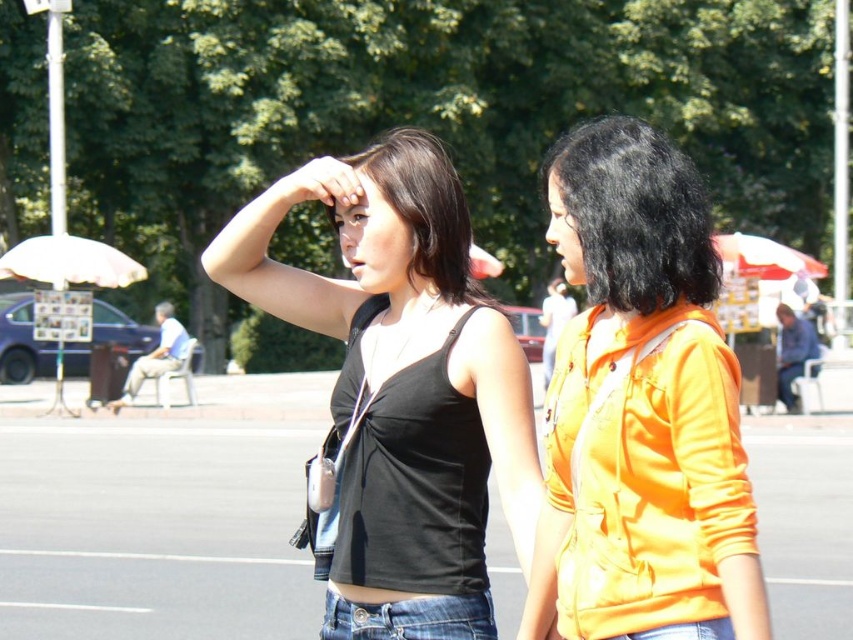
Question: Estimate the real-world distances between objects in this image. Which object is closer to the jeans at center?

Choices:
 (A) black silky hair at upper right
 (B) black matte tank top at center
 (C) orange matte jacket at right
 (D) black smooth hair at center

Answer: (C)

Question: Is black silky hair at upper right above jeans at center?

Choices:
 (A) no
 (B) yes

Answer: (B)

Question: In this image, where is orange matte jacket at right located relative to black silky hair at upper right?

Choices:
 (A) left
 (B) right

Answer: (A)

Question: Is black matte tank top at center positioned before jeans at center?

Choices:
 (A) no
 (B) yes

Answer: (A)

Question: Which of the following is the closest to the observer?

Choices:
 (A) blue denim jeans at lower center
 (B) black smooth hair at center

Answer: (A)

Question: Which object is farther from the camera taking this photo?

Choices:
 (A) black smooth hair at center
 (B) black silky hair at upper right
 (C) orange matte jacket at right

Answer: (A)